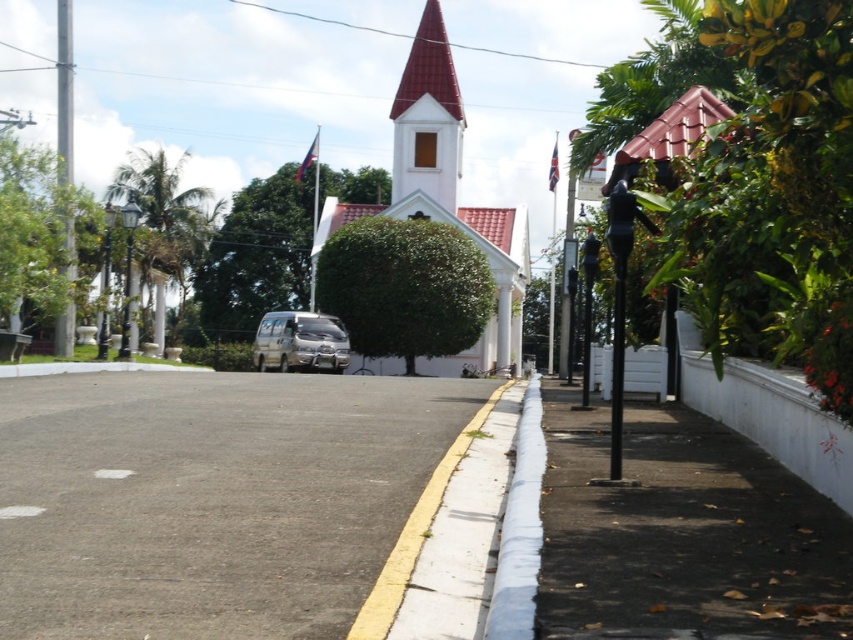
Question: Which point appears closest to the camera in this image?

Choices:
 (A) (393, 163)
 (B) (299, 333)
 (C) (502, 618)

Answer: (C)

Question: Which point is farther to the camera?

Choices:
 (A) white wood spire at center
 (B) white matte church at center

Answer: (A)

Question: Can you confirm if gray asphalt pavement at center is positioned to the left of silver metallic van at center?

Choices:
 (A) yes
 (B) no

Answer: (B)

Question: Is white matte church at center smaller than white painted concrete curb at lower center?

Choices:
 (A) no
 (B) yes

Answer: (A)

Question: Is white painted concrete curb at lower center to the left of metallic pole at left from the viewer's perspective?

Choices:
 (A) yes
 (B) no

Answer: (B)

Question: Which point is farther to the camera?

Choices:
 (A) (331, 346)
 (B) (410, 168)
 (C) (529, 442)

Answer: (B)